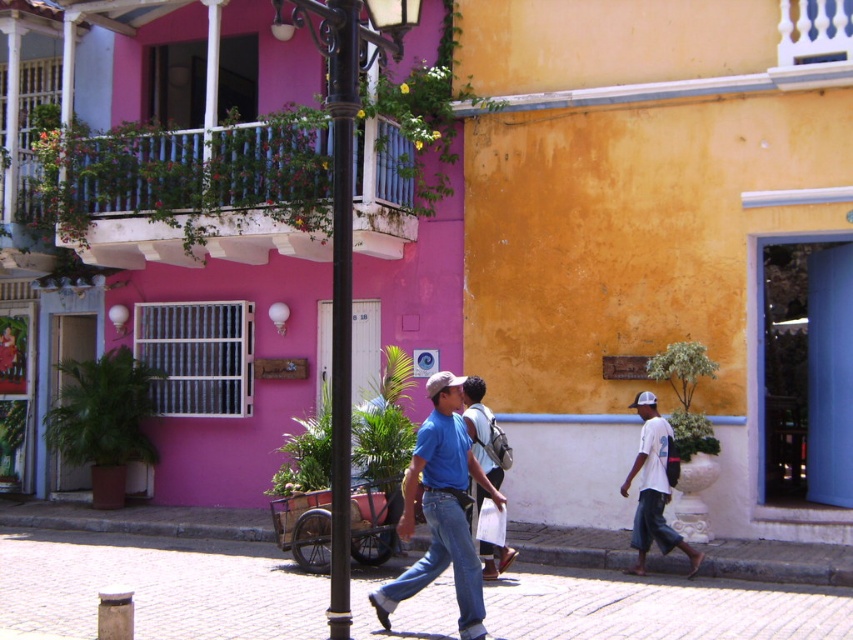
Which is below, black metal pole at center or white cotton shirt at right?

Positioned lower is white cotton shirt at right.

Does black metal pole at center appear under white cotton shirt at right?

No.

Between point (340, 157) and point (641, 467), which one is positioned behind?

The point (641, 467) is behind.

Where is `black metal pole at center`? Image resolution: width=853 pixels, height=640 pixels. black metal pole at center is located at coordinates (341, 288).

Can you confirm if brick pavement at center is shorter than white cotton shirt at right?

Correct, brick pavement at center is not as tall as white cotton shirt at right.

Is point (83, 605) more distant than point (648, 436)?

No, it is in front of (648, 436).

Is point (549, 621) positioned after point (671, 545)?

No, (549, 621) is closer to viewer.

The height and width of the screenshot is (640, 853). I want to click on brick pavement at center, so click(155, 586).

Is white cotton shirt at right above matte blue shirt at center?

Actually, white cotton shirt at right is below matte blue shirt at center.

Which is more to the left, white cotton shirt at right or matte blue shirt at center?

matte blue shirt at center is more to the left.

You are a GUI agent. You are given a task and a screenshot of the screen. Output one action in this format:
    pyautogui.click(x=<x>, y=<y>)
    Task: Click on the white cotton shirt at right
    This screenshot has width=853, height=640.
    Given the screenshot: What is the action you would take?
    pyautogui.click(x=653, y=488)